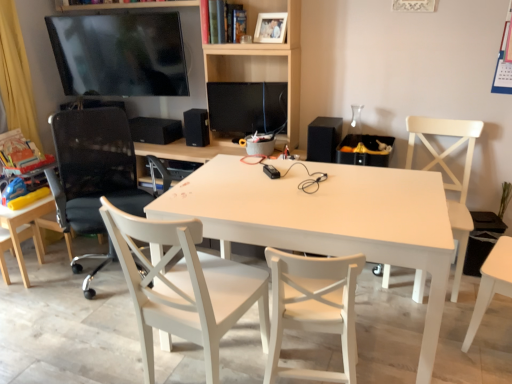
The image size is (512, 384). Identify the location of free spot above matte black tv at upper left (from a real-world perspective). (113, 5).